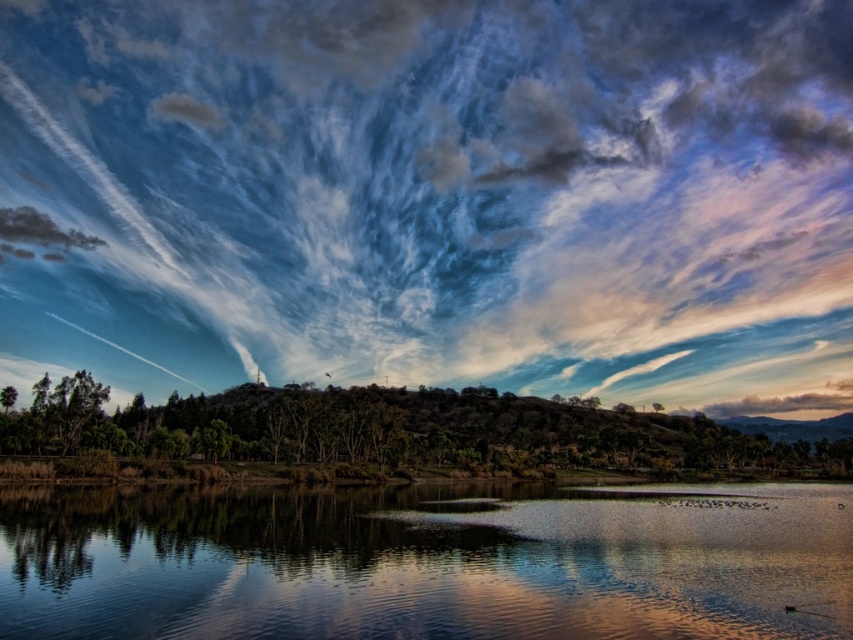
The height and width of the screenshot is (640, 853). Describe the element at coordinates (426, 564) in the screenshot. I see `smooth reflective water at center` at that location.

At what (x,y) coordinates should I click in order to perform the action: click on smooth reflective water at center. Please return your answer as a coordinate pair (x, y). Looking at the image, I should click on (426, 564).

Is cloudy sky at center thinner than green matte tree at center?

No, cloudy sky at center is not thinner than green matte tree at center.

Which is in front, point (167, 16) or point (491, 416)?

Point (491, 416) is in front.

Who is more forward, (x=498, y=253) or (x=759, y=465)?

Positioned in front is point (x=759, y=465).

Where is `cloudy sky at center`? The height and width of the screenshot is (640, 853). cloudy sky at center is located at coordinates (434, 196).

Does cloudy sky at center have a lesser height compared to smooth reflective water at center?

No.

Is cloudy sky at center closer to camera compared to smooth reflective water at center?

That is False.

Does point (519, 237) come behind point (763, 486)?

Yes, point (519, 237) is farther from viewer.

I want to click on cloudy sky at center, so click(x=434, y=196).